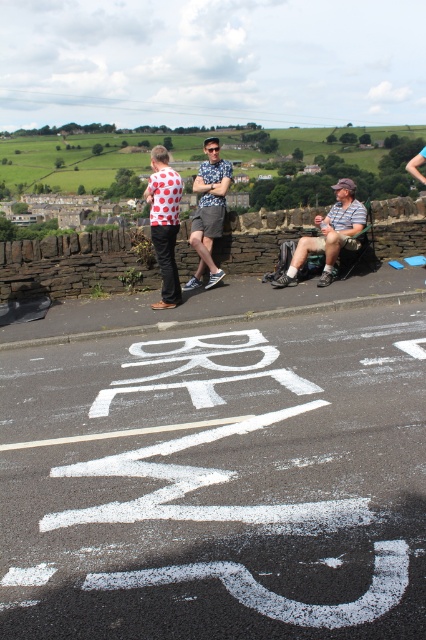
Question: Which point is farther from the camera taking this photo?

Choices:
 (A) (322, 225)
 (B) (213, 209)

Answer: (B)

Question: Considering the relative positions of striped shirt at center and matte gray shorts at center in the image provided, where is striped shirt at center located with respect to matte gray shorts at center?

Choices:
 (A) right
 (B) left

Answer: (A)

Question: Does striped shirt at center appear over matte gray shorts at center?

Choices:
 (A) yes
 (B) no

Answer: (B)

Question: Is striped shirt at center bigger than matte gray shorts at center?

Choices:
 (A) yes
 (B) no

Answer: (B)